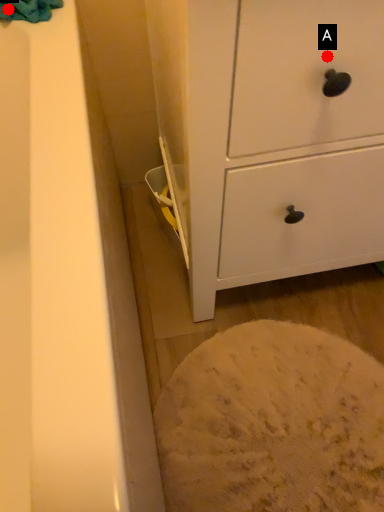
Question: Two points are circled on the image, labeled by A and B beside each circle. Among these points, which one is farthest from the camera?

Choices:
 (A) A is further
 (B) B is further

Answer: (B)